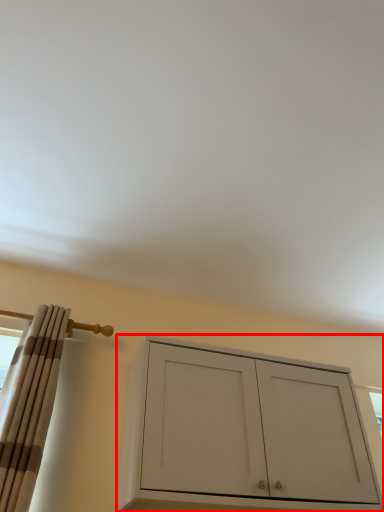
Question: From the image's perspective, what is the correct spatial positioning of cabinetry (annotated by the red box) in reference to curtain?

Choices:
 (A) above
 (B) below

Answer: (B)